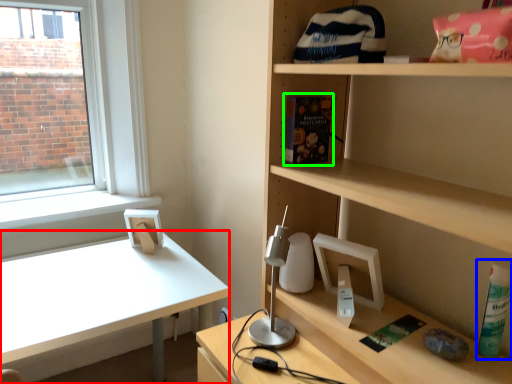
Question: Which is nearer to the desk (highlighted by a red box)? bottle (highlighted by a blue box) or book (highlighted by a green box).

Choices:
 (A) bottle
 (B) book

Answer: (B)